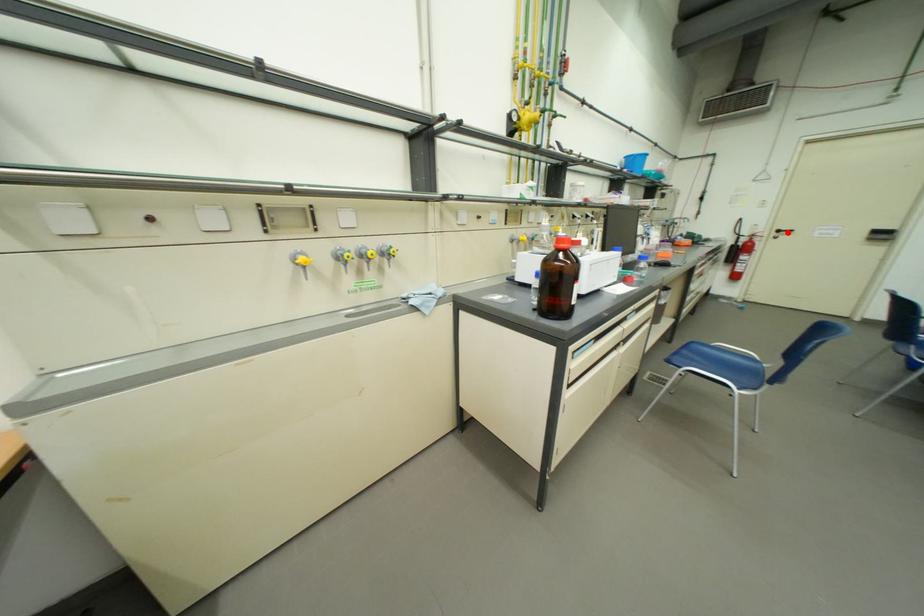
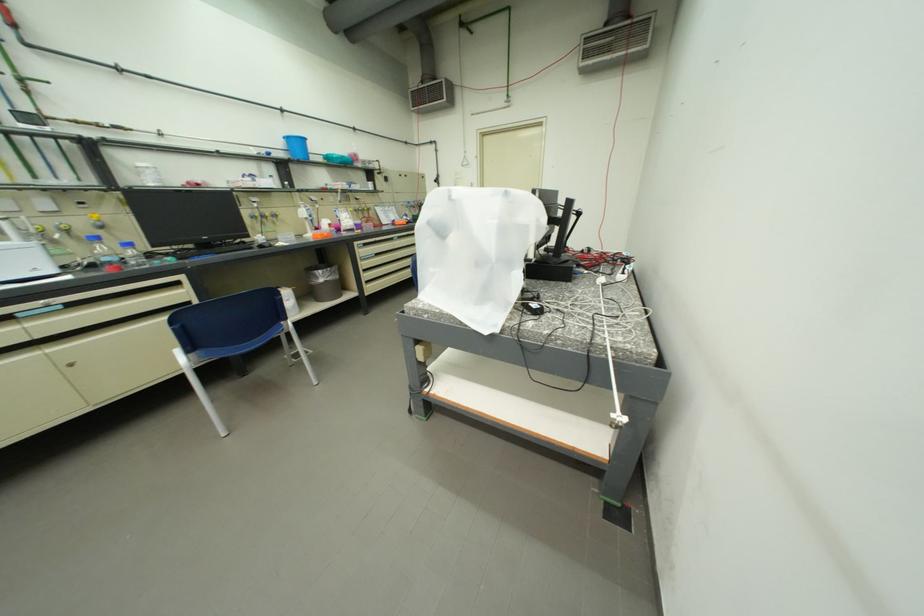
Question: I am providing you with two images of the same scene from different viewpoints. A red point is marked on the first image. Is the red point's position out of view in image 2?

Choices:
 (A) Yes
 (B) No

Answer: (A)